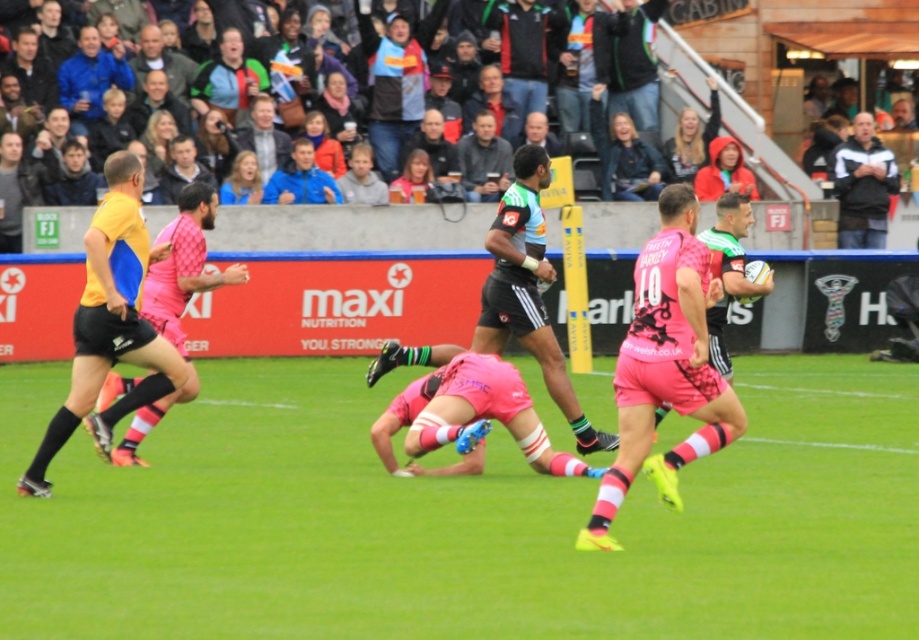
Which is more to the left, green grass football field at center or black matte shorts at center?

green grass football field at center is more to the left.

Is green grass football field at center thinner than black matte shorts at center?

No.

Between point (270, 481) and point (536, 276), which one is positioned in front?

Point (270, 481) is more forward.

Find the location of a particular element. The image size is (919, 640). green grass football field at center is located at coordinates (461, 520).

Describe the element at coordinates (665, 365) in the screenshot. I see `pink matte jersey at center` at that location.

Where is `pink matte jersey at center`? This screenshot has height=640, width=919. pink matte jersey at center is located at coordinates (665, 365).

You are a GUI agent. You are given a task and a screenshot of the screen. Output one action in this format:
    pyautogui.click(x=<x>, y=<y>)
    Task: Click on the pink matte jersey at center
    This screenshot has height=640, width=919.
    Given the screenshot: What is the action you would take?
    pyautogui.click(x=665, y=365)

Between yellow matte shorts at left and black matte shorts at center, which one is positioned higher?

black matte shorts at center is higher up.

Does point (149, 248) lie in front of point (498, 324)?

Yes.

Identify the location of yellow matte shorts at left. (110, 323).